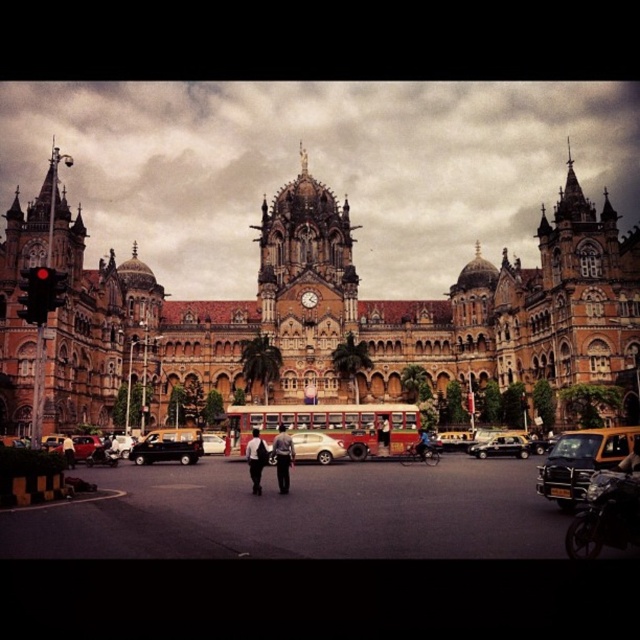
Question: Does yellow matte taxi at lower right have a lesser width compared to black fabric person at center?

Choices:
 (A) yes
 (B) no

Answer: (B)

Question: Which of these objects is positioned closest to the white fabric shirt at center?

Choices:
 (A) yellow matte taxi at lower right
 (B) red matte bus at center
 (C) matte black car at center
 (D) black fabric person at center

Answer: (B)

Question: Which of the following is the closest to the observer?

Choices:
 (A) (570, 496)
 (B) (208, 442)

Answer: (A)

Question: Which point is closer to the camera?

Choices:
 (A) red matte bus at center
 (B) dark blue jeans at center

Answer: (B)

Question: Can you confirm if metallic silver van at center is thinner than black glossy car at center?

Choices:
 (A) no
 (B) yes

Answer: (A)

Question: Does black glossy car at center appear on the left side of metallic silver sedan at center?

Choices:
 (A) no
 (B) yes

Answer: (A)